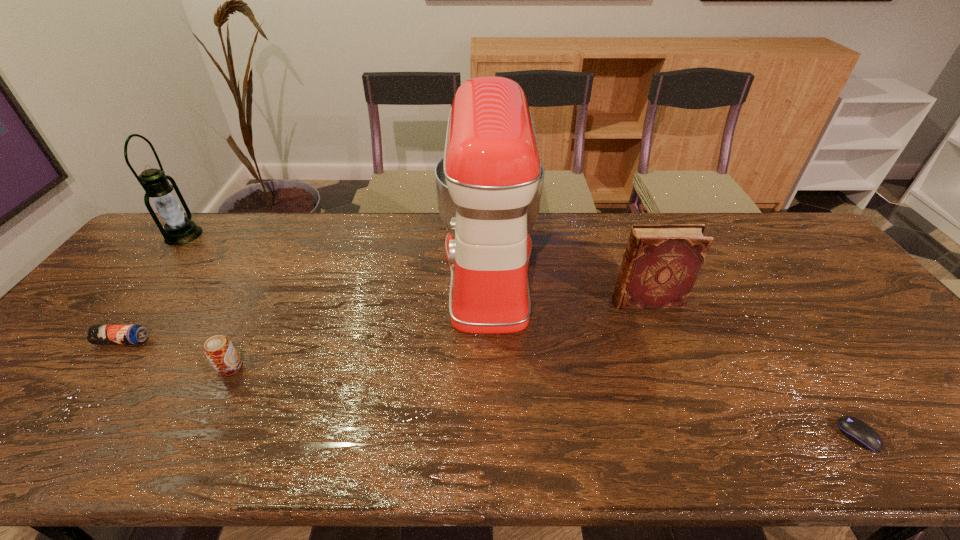
Where is `the fourth object from left to right`? The width and height of the screenshot is (960, 540). the fourth object from left to right is located at coordinates (489, 184).

Identify the location of mixer. (489, 184).

I want to click on the second tallest object, so click(179, 230).

Image resolution: width=960 pixels, height=540 pixels. I want to click on the second object from right to left, so click(x=661, y=263).

Locate an element on the screen. The image size is (960, 540). hardback book is located at coordinates (661, 263).

Locate an element on the screen. The height and width of the screenshot is (540, 960). the third object from left to right is located at coordinates (219, 350).

The image size is (960, 540). Find the location of `the taller beer can`. the taller beer can is located at coordinates coord(219,350).

What are the coordinates of `the left beer can` in the screenshot? It's located at (97, 334).

Where is `the farther beer can`? This screenshot has width=960, height=540. the farther beer can is located at coordinates (97, 334).

Identify the location of the rightmost object. (856, 430).